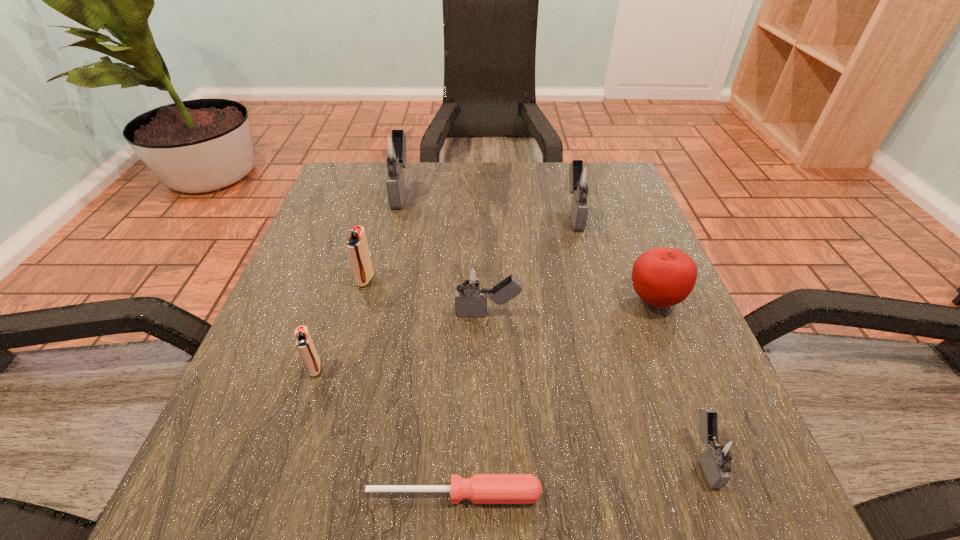
Where is `the smaller red igniter`? Image resolution: width=960 pixels, height=540 pixels. the smaller red igniter is located at coordinates (304, 343).

Identify the location of the rightmost gray igniter. This screenshot has width=960, height=540. (722, 455).

Find the location of a particular element. The height and width of the screenshot is (540, 960). the smallest gray igniter is located at coordinates (722, 455).

Where is `red screwdriver`? Image resolution: width=960 pixels, height=540 pixels. red screwdriver is located at coordinates (481, 488).

This screenshot has width=960, height=540. Identify the location of the shortest object. point(481,488).

This screenshot has width=960, height=540. In order to click on vacant space located 0.280m on the right of the tallest igniter in this screenshot , I will do `click(534, 191)`.

Locate an element on the screen. The width and height of the screenshot is (960, 540). vacant space located 0.070m on the front of the third gray igniter from left to right is located at coordinates (586, 253).

Find the location of a particular element. The image size is (960, 540). vacant space located 0.310m on the left of the second gray igniter from left to right is located at coordinates (283, 314).

Find the location of a particular element. The height and width of the screenshot is (540, 960). vacant region located 0.170m on the front of the farther red igniter is located at coordinates (343, 361).

Where is `free location located 0.350m on the left of the apple`? The width and height of the screenshot is (960, 540). free location located 0.350m on the left of the apple is located at coordinates (437, 300).